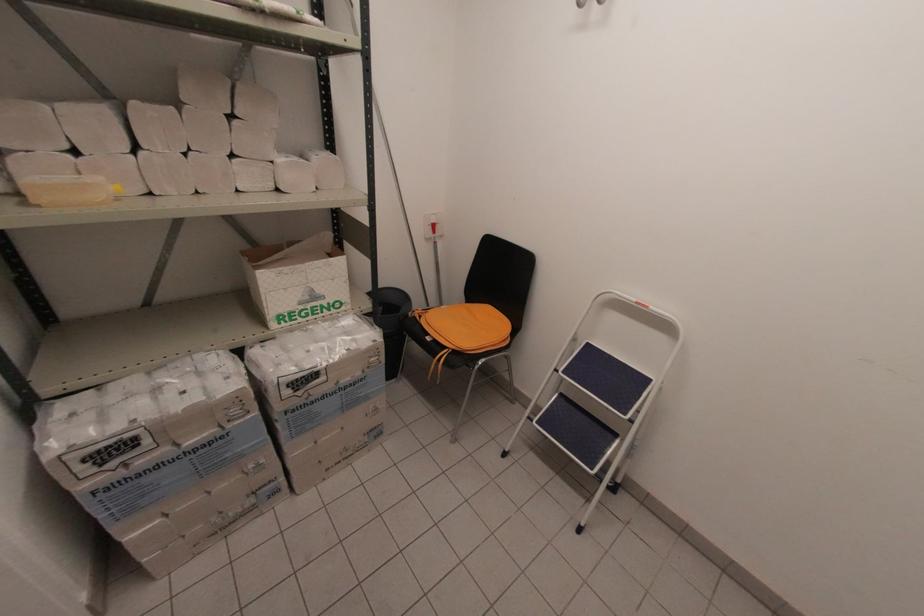
What do you see at coordinates (480, 326) in the screenshot?
I see `a chair sitting surface` at bounding box center [480, 326].